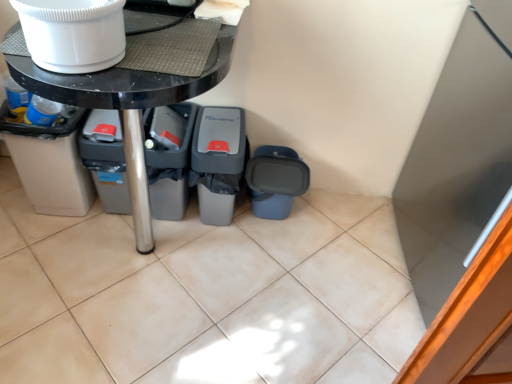
You are a GUI agent. You are given a task and a screenshot of the screen. Output one action in this format:
    pyautogui.click(x=<x>, y=<y>)
    Task: Click on the vacant region above gray plastic bin at lower left (from a real-world perspective)
    The height and width of the screenshot is (384, 512).
    Given the screenshot: What is the action you would take?
    pyautogui.click(x=105, y=118)